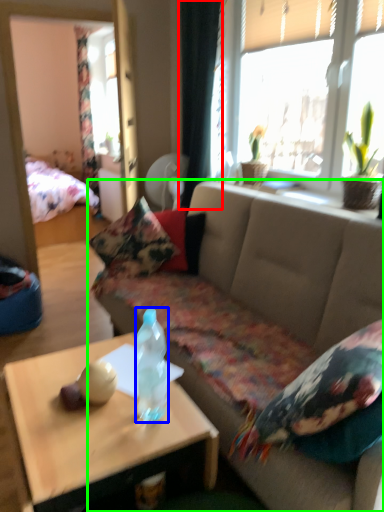
Question: Based on their relative distances, which object is nearer to curtain (highlighted by a red box)? Choose from bottle (highlighted by a blue box) and studio couch (highlighted by a green box).

Choices:
 (A) bottle
 (B) studio couch

Answer: (B)